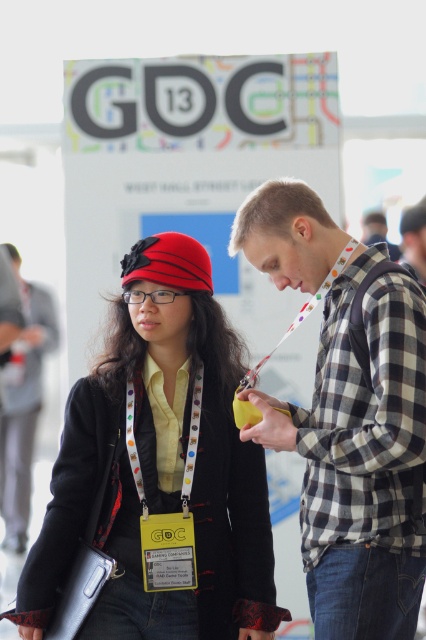
Question: Which point is farther to the camera?

Choices:
 (A) yellow fabric lanyard at center
 (B) checkered fabric shirt at center
 (C) matte black coat at center

Answer: (A)

Question: Is checkered fabric shirt at center wider than matte black jacket at center?

Choices:
 (A) no
 (B) yes

Answer: (B)

Question: From the image, what is the correct spatial relationship of checkered fabric shirt at center in relation to yellow fabric lanyard at center?

Choices:
 (A) above
 (B) below

Answer: (A)

Question: Can you confirm if matte black coat at center is positioned below yellow fabric lanyard at center?

Choices:
 (A) yes
 (B) no

Answer: (A)

Question: Which object appears farthest from the camera in this image?

Choices:
 (A) matte black jacket at center
 (B) yellow fabric lanyard at center

Answer: (A)

Question: Which point is farther from the camera taking this photo?

Choices:
 (A) (388, 332)
 (B) (17, 509)

Answer: (B)